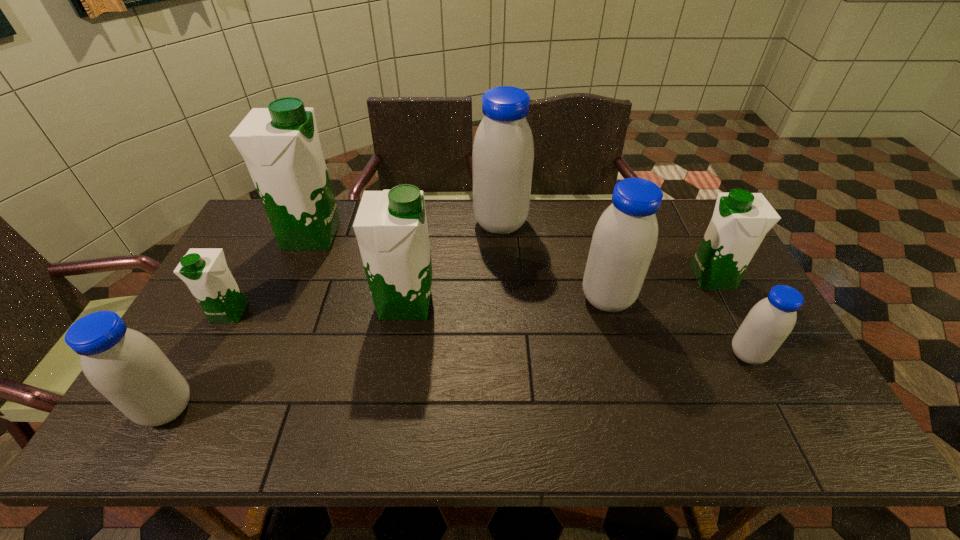
Find the location of a particular element. The height and width of the screenshot is (540, 960). vacant space at the far left corner is located at coordinates (268, 241).

Find the location of a particular element. The width and height of the screenshot is (960, 540). vacant space at the far right corner of the desktop is located at coordinates (684, 242).

Where is `vacant space that is in between the fifth object from left to right and the third smallest blue soya milk`? vacant space that is in between the fifth object from left to right and the third smallest blue soya milk is located at coordinates (554, 261).

Where is `vacant point located between the fifth object from right to left and the biggest green soya milk`? The height and width of the screenshot is (540, 960). vacant point located between the fifth object from right to left and the biggest green soya milk is located at coordinates (358, 269).

The image size is (960, 540). I want to click on empty space that is in between the nearest soya milk and the third smallest green soya milk, so click(x=286, y=355).

Identify the location of free spot between the second nearest soya milk and the farthest green soya milk. (529, 294).

This screenshot has height=540, width=960. I want to click on vacant area that lies between the biggest green soya milk and the nearest blue soya milk, so [x=239, y=321].

You are a GUI agent. You are given a task and a screenshot of the screen. Output one action in this format:
    pyautogui.click(x=<x>, y=<y>)
    Task: Click on the unoccupied position between the nearest soya milk and the third smallest green soya milk
    
    Given the screenshot: What is the action you would take?
    pyautogui.click(x=286, y=355)

Where is `empty space between the second farthest blue soya milk and the farthest green soya milk`? empty space between the second farthest blue soya milk and the farthest green soya milk is located at coordinates [x=459, y=267].

Identify the location of free space between the farthest green soya milk and the seventh farthest object. The width and height of the screenshot is (960, 540). (529, 294).